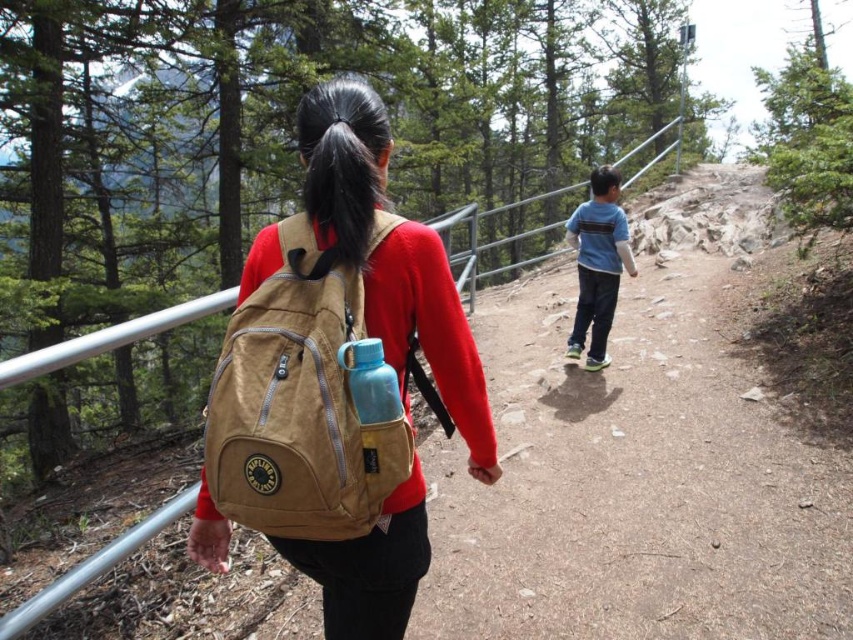
Question: Which point is closer to the camera?

Choices:
 (A) tan canvas backpack at back
 (B) blue cotton shirt at center

Answer: (A)

Question: Does black hair at upper center have a smaller size compared to blue matte water bottle at back?

Choices:
 (A) yes
 (B) no

Answer: (B)

Question: Among these objects, which one is nearest to the camera?

Choices:
 (A) blue matte water bottle at back
 (B) tan canvas backpack at back

Answer: (B)

Question: Is the position of brown canvas backpack at center more distant than that of black hair at upper center?

Choices:
 (A) no
 (B) yes

Answer: (A)

Question: Among these objects, which one is farthest from the camera?

Choices:
 (A) black hair at upper center
 (B) brown canvas backpack at center

Answer: (A)

Question: Is blue cotton shirt at center bigger than blue matte water bottle at back?

Choices:
 (A) no
 (B) yes

Answer: (B)